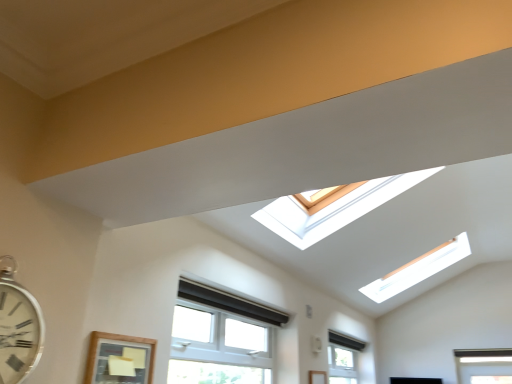
What do you see at coordinates (221, 332) in the screenshot?
I see `white plastic window at lower center, the second window positioned from the front` at bounding box center [221, 332].

The height and width of the screenshot is (384, 512). Describe the element at coordinates (343, 357) in the screenshot. I see `clear glass window at lower center, the 1th window viewed from the right` at that location.

Identify the location of wooden-framed window at lower left, which appears as the 1th window when viewed from the left. This screenshot has height=384, width=512. (119, 359).

Is white metallic clock at left to the left of clear glass window at lower center, the third window when ordered from left to right, from the viewer's perspective?

Yes, white metallic clock at left is to the left of clear glass window at lower center, the third window when ordered from left to right.

From a real-world perspective, relative to clear glass window at lower center, the third window when ordered from left to right, is white metallic clock at left vertically above or below?

white metallic clock at left is situated lower than clear glass window at lower center, the third window when ordered from left to right, in the real world.

Where is `the 3rd window to the right of the white metallic clock at left, starting your count from the anchor`? The image size is (512, 384). the 3rd window to the right of the white metallic clock at left, starting your count from the anchor is located at coordinates (343, 357).

Is white metallic clock at left situated inside clear glass window at lower center, the third window when ordered from left to right, or outside?

white metallic clock at left exists outside the volume of clear glass window at lower center, the third window when ordered from left to right.

Considering the positions of points (338, 332) and (240, 334), is point (338, 332) closer to camera compared to point (240, 334)?

No, (338, 332) is further to viewer.

Considering the positions of objects clear glass window at lower center, the 1th window viewed from the right, and white plastic window at lower center, the second window positioned from the front, in the image provided, who is more to the left, clear glass window at lower center, the 1th window viewed from the right, or white plastic window at lower center, the second window positioned from the front,?

Positioned to the left is white plastic window at lower center, the second window positioned from the front.

From the image's perspective, between clear glass window at lower center, the 3th window viewed from the front, and white plastic window at lower center, the second window positioned from the front, who is located below?

clear glass window at lower center, the 3th window viewed from the front.

This screenshot has width=512, height=384. I want to click on the 1st window behind the wooden-framed window at lower left, which appears as the 3th window when viewed from the right, so click(x=221, y=332).

How many degrees apart are the facing directions of wooden-framed window at lower left, the third window when ordered from back to front, and white plastic window at lower center, placed as the second window when sorted from left to right?

1.08 degrees.

Consider the image. Considering the sizes of objects wooden-framed window at lower left, which appears as the 3th window when viewed from the right, and white plastic window at lower center, the second window positioned from the front, in the image provided, who is thinner, wooden-framed window at lower left, which appears as the 3th window when viewed from the right, or white plastic window at lower center, the second window positioned from the front,?

With smaller width is wooden-framed window at lower left, which appears as the 3th window when viewed from the right.

Does wooden-framed window at lower left, which appears as the 1th window when viewed from the left, turn towards white plastic window at lower center, marked as the 2th window in a right-to-left arrangement?

No, wooden-framed window at lower left, which appears as the 1th window when viewed from the left, does not turn towards white plastic window at lower center, marked as the 2th window in a right-to-left arrangement.

Based on the photo, is wooden-framed window at lower left, which appears as the 3th window when viewed from the right, located within clear glass window at lower center, the 3th window viewed from the front?

No, wooden-framed window at lower left, which appears as the 3th window when viewed from the right, is not surrounded by clear glass window at lower center, the 3th window viewed from the front.

Who is taller, clear glass window at lower center, the third window when ordered from left to right, or wooden-framed window at lower left, the third window when ordered from back to front?

wooden-framed window at lower left, the third window when ordered from back to front.

Is clear glass window at lower center, which is counted as the first window, starting from the back, wider than wooden-framed window at lower left, which appears as the 1th window when viewed from the left?

Yes, clear glass window at lower center, which is counted as the first window, starting from the back, is wider than wooden-framed window at lower left, which appears as the 1th window when viewed from the left.

What's the angular difference between clear glass window at lower center, the third window when ordered from left to right, and wooden-framed window at lower left, which ranks as the 1th window in front-to-back order,'s facing directions?

The angular difference between clear glass window at lower center, the third window when ordered from left to right, and wooden-framed window at lower left, which ranks as the 1th window in front-to-back order, is 0.00206 degrees.

Are white metallic clock at left and white plastic window at lower center, which is the 2th window in back-to-front order, beside each other?

white metallic clock at left and white plastic window at lower center, which is the 2th window in back-to-front order, are not in contact.

From their relative heights in the image, would you say white metallic clock at left is taller or shorter than white plastic window at lower center, the second window positioned from the front?

Clearly, white metallic clock at left is shorter compared to white plastic window at lower center, the second window positioned from the front.

Considering their positions, is white metallic clock at left located in front of or behind white plastic window at lower center, marked as the 2th window in a right-to-left arrangement?

white metallic clock at left is in front of white plastic window at lower center, marked as the 2th window in a right-to-left arrangement.

From a real-world perspective, count 1st windows upward from the white metallic clock at left and point to it. Please provide its 2D coordinates.

[(221, 332)]

Looking at this image, is white plastic window at lower center, marked as the 2th window in a right-to-left arrangement, positioned far away from clear glass window at lower center, which is counted as the first window, starting from the back?

That's right, there is a large distance between white plastic window at lower center, marked as the 2th window in a right-to-left arrangement, and clear glass window at lower center, which is counted as the first window, starting from the back.

Can you confirm if white plastic window at lower center, which is the 2th window in back-to-front order, is positioned to the left of clear glass window at lower center, the third window when ordered from left to right?

Correct, you'll find white plastic window at lower center, which is the 2th window in back-to-front order, to the left of clear glass window at lower center, the third window when ordered from left to right.

From the image's perspective, is white plastic window at lower center, placed as the second window when sorted from left to right, on top of clear glass window at lower center, the 1th window viewed from the right?

Correct, white plastic window at lower center, placed as the second window when sorted from left to right, appears higher than clear glass window at lower center, the 1th window viewed from the right, in the image.

Relative to clear glass window at lower center, the 3th window viewed from the front, is white plastic window at lower center, the second window positioned from the front, in front or behind?

white plastic window at lower center, the second window positioned from the front, is in front of clear glass window at lower center, the 3th window viewed from the front.

From a real-world perspective, which is physically below, wooden-framed window at lower left, which ranks as the 1th window in front-to-back order, or white metallic clock at left?

wooden-framed window at lower left, which ranks as the 1th window in front-to-back order, is physically lower.

From the image's perspective, is wooden-framed window at lower left, the third window when ordered from back to front, positioned above or below white metallic clock at left?

From the image's perspective, wooden-framed window at lower left, the third window when ordered from back to front, appears below white metallic clock at left.

Which object is positioned more to the left, wooden-framed window at lower left, which appears as the 3th window when viewed from the right, or white metallic clock at left?

Answer: From the viewer's perspective, white metallic clock at left appears more on the left side.

Where is `clock in front of the clear glass window at lower center, which is counted as the first window, starting from the back`? The height and width of the screenshot is (384, 512). clock in front of the clear glass window at lower center, which is counted as the first window, starting from the back is located at coordinates (18, 327).

This screenshot has height=384, width=512. In order to click on window that is the 1st object to the left of the clear glass window at lower center, the 1th window viewed from the right, starting at the anchor in this screenshot , I will do `click(221, 332)`.

From the image, which object appears to be farther from clear glass window at lower center, the 1th window viewed from the right, wooden-framed window at lower left, which appears as the 1th window when viewed from the left, or white metallic clock at left?

Based on the image, white metallic clock at left appears to be further to clear glass window at lower center, the 1th window viewed from the right.

When comparing their distances from white metallic clock at left, does clear glass window at lower center, which is counted as the first window, starting from the back, or white plastic window at lower center, marked as the 2th window in a right-to-left arrangement, seem closer?

white plastic window at lower center, marked as the 2th window in a right-to-left arrangement, lies closer to white metallic clock at left than the other object.

Considering their positions, is white plastic window at lower center, placed as the second window when sorted from left to right, positioned closer to clear glass window at lower center, which is counted as the first window, starting from the back, than white metallic clock at left?

Among the two, white plastic window at lower center, placed as the second window when sorted from left to right, is located nearer to clear glass window at lower center, which is counted as the first window, starting from the back.

When comparing their distances from white metallic clock at left, does clear glass window at lower center, which is counted as the first window, starting from the back, or wooden-framed window at lower left, the third window when ordered from back to front, seem closer?

wooden-framed window at lower left, the third window when ordered from back to front, is closer to white metallic clock at left.

Looking at the image, which one is located further to white metallic clock at left, white plastic window at lower center, placed as the second window when sorted from left to right, or wooden-framed window at lower left, the third window when ordered from back to front?

white plastic window at lower center, placed as the second window when sorted from left to right, is further to white metallic clock at left.

Considering their positions, is white metallic clock at left positioned further to wooden-framed window at lower left, which appears as the 3th window when viewed from the right, than white plastic window at lower center, which is the 2th window in back-to-front order?

white plastic window at lower center, which is the 2th window in back-to-front order, is further to wooden-framed window at lower left, which appears as the 3th window when viewed from the right.

Estimate the real-world distances between objects in this image. Which object is further from clear glass window at lower center, which is counted as the first window, starting from the back, white plastic window at lower center, which is the 2th window in back-to-front order, or wooden-framed window at lower left, which appears as the 3th window when viewed from the right?

wooden-framed window at lower left, which appears as the 3th window when viewed from the right.

From the picture: Based on their spatial positions, is white plastic window at lower center, placed as the second window when sorted from left to right, or white metallic clock at left closer to wooden-framed window at lower left, which appears as the 3th window when viewed from the right?

white metallic clock at left.

At what (x,y) coordinates should I click in order to perform the action: click on window between wooden-framed window at lower left, which ranks as the 1th window in front-to-back order, and clear glass window at lower center, the 3th window viewed from the front, in the front-back direction. Please return your answer as a coordinate pair (x, y). The height and width of the screenshot is (384, 512). Looking at the image, I should click on coord(221,332).

Locate an element on the screen. The width and height of the screenshot is (512, 384). window between white metallic clock at left and white plastic window at lower center, placed as the second window when sorted from left to right, from front to back is located at coordinates (119, 359).